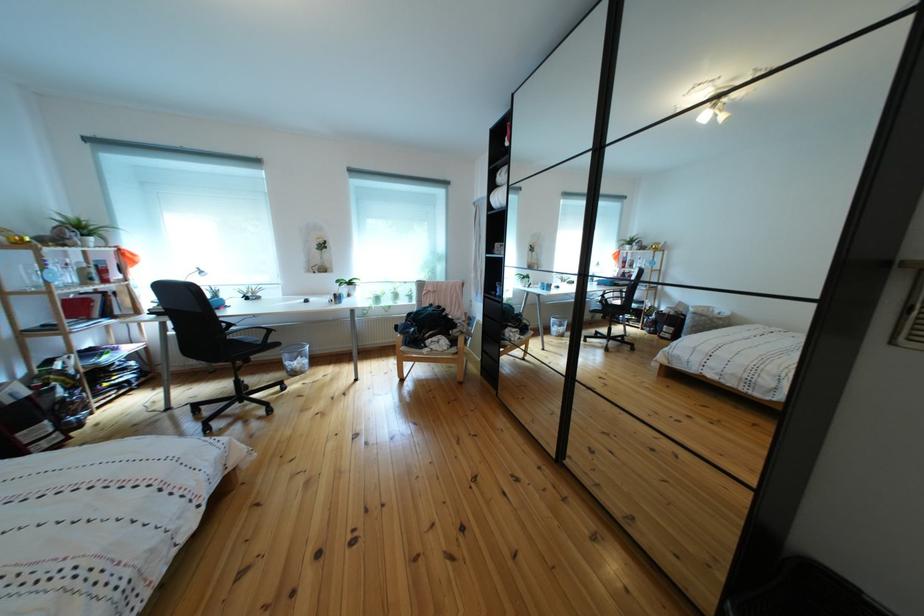
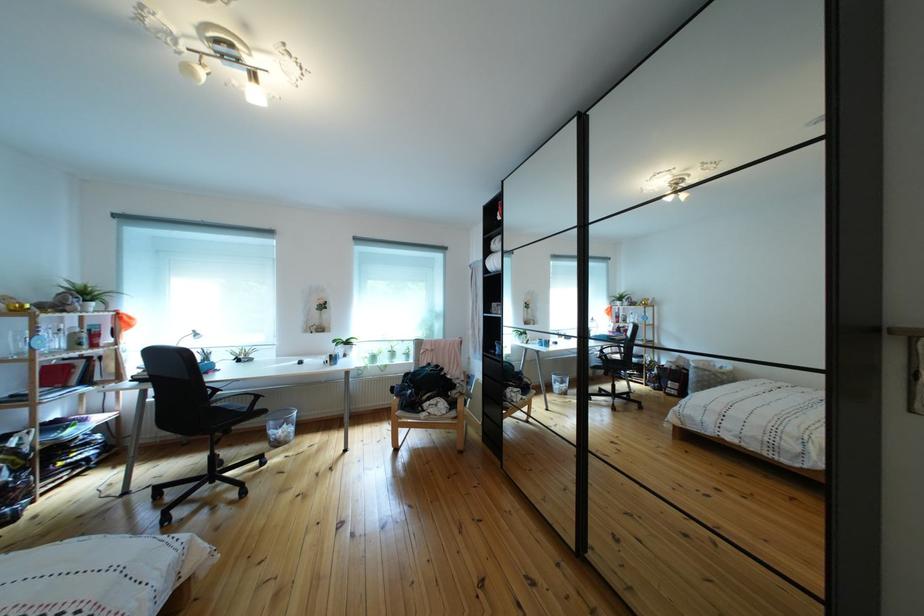
In the second image, find the point that corresponds to point 469,331 in the first image.

(469, 391)